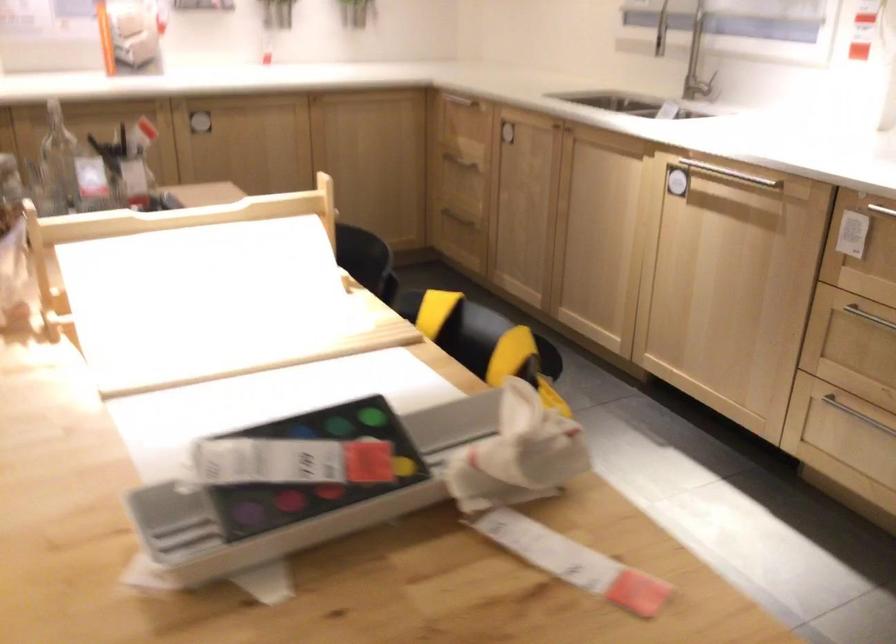
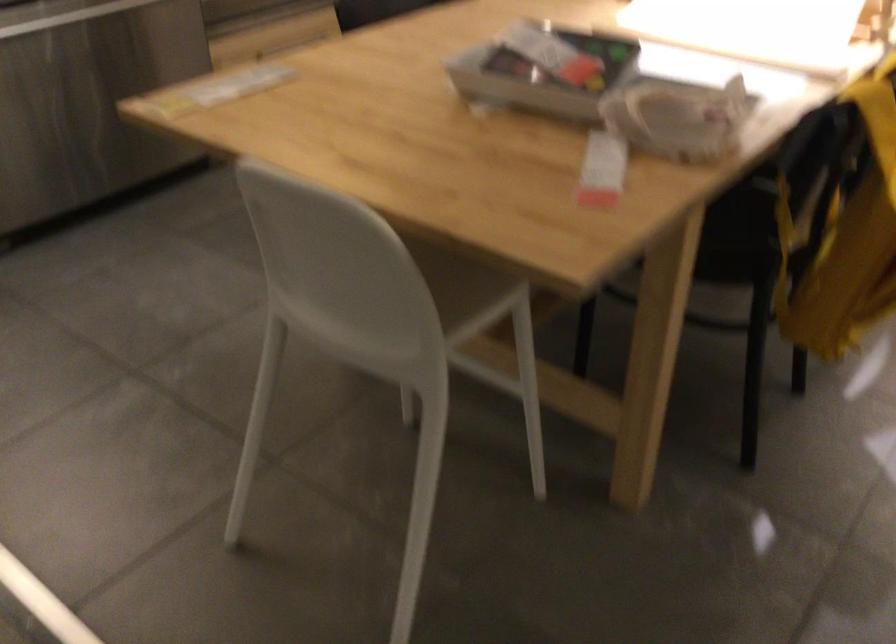
In the second image, find the point that corresponds to pixel 263 498 in the first image.

(544, 73)